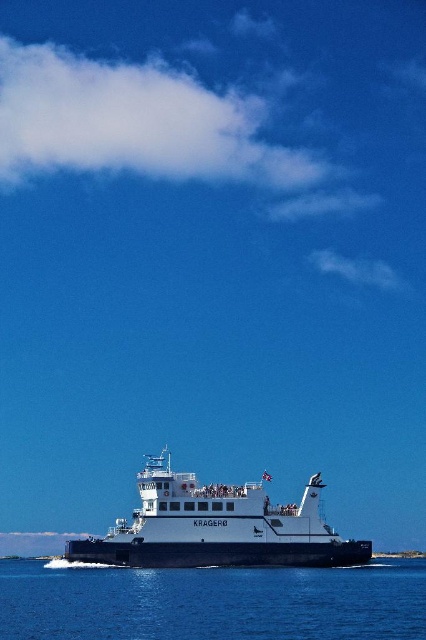
Question: Which point is closer to the camera?

Choices:
 (A) (193, 500)
 (B) (77, 602)

Answer: (B)

Question: Which point is farther to the camera?

Choices:
 (A) transparent blue water at lower center
 (B) white matte ferry at center

Answer: (B)

Question: Can you confirm if transparent blue water at lower center is thinner than white matte ferry at center?

Choices:
 (A) yes
 (B) no

Answer: (B)

Question: Is transparent blue water at lower center to the left of white matte ferry at center from the viewer's perspective?

Choices:
 (A) no
 (B) yes

Answer: (A)

Question: Is transparent blue water at lower center thinner than white matte ferry at center?

Choices:
 (A) yes
 (B) no

Answer: (B)